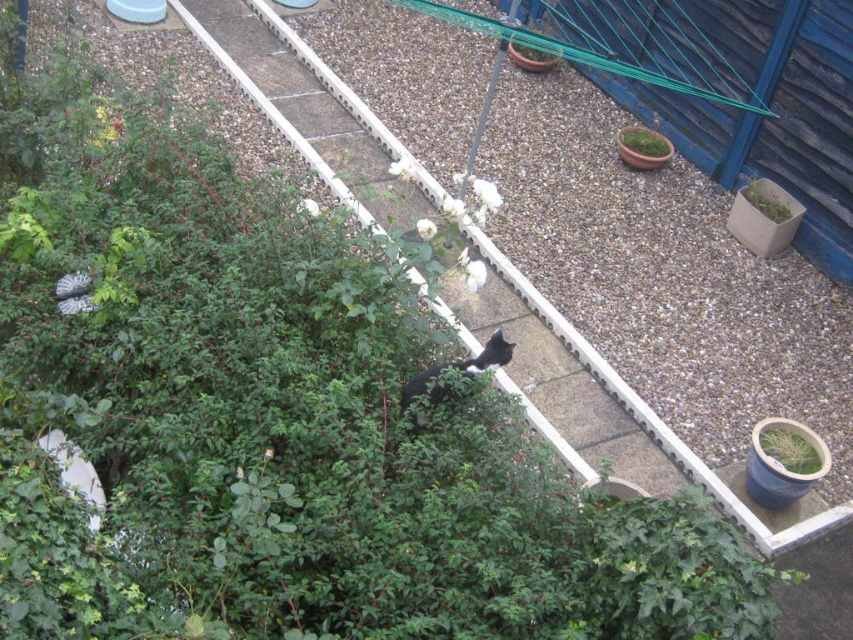
Who is lower down, green leafy plant at lower right or black fur cat at center?

green leafy plant at lower right is below.

Does green leafy plant at lower right have a greater height compared to black fur cat at center?

Incorrect, green leafy plant at lower right's height is not larger of black fur cat at center's.

Where is `green leafy plant at lower right`? The height and width of the screenshot is (640, 853). green leafy plant at lower right is located at coordinates (791, 449).

Who is more distant from viewer, (796, 449) or (779, 196)?

Point (779, 196)

Who is shorter, green leafy plant at lower right or green leafy plant at upper right?

Standing shorter between the two is green leafy plant at lower right.

Is point (793, 428) positioned after point (766, 180)?

That is False.

The image size is (853, 640). Find the location of `green leafy plant at lower right`. green leafy plant at lower right is located at coordinates (791, 449).

Looking at this image, between green wire fence at upper right and green leafy plant at upper right, which one has less height?

With less height is green leafy plant at upper right.

Between point (766, 145) and point (747, 186), which one is positioned behind?

The point (766, 145) is more distant.

The image size is (853, 640). What do you see at coordinates (770, 109) in the screenshot?
I see `green wire fence at upper right` at bounding box center [770, 109].

Image resolution: width=853 pixels, height=640 pixels. I want to click on green wire fence at upper right, so click(x=770, y=109).